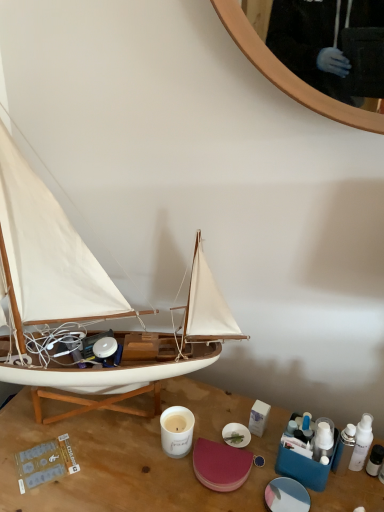
What are the coordinates of `wooden sailboat at left` in the screenshot? It's located at (87, 298).

In order to face wooden sailboat at left, should I rotate leftwards or rightwards?

Turn left approximately 12.879 degrees to face it.

The height and width of the screenshot is (512, 384). What do you see at coordinates (87, 298) in the screenshot? I see `wooden sailboat at left` at bounding box center [87, 298].

Where is `wooden desk at center`? This screenshot has height=512, width=384. wooden desk at center is located at coordinates (123, 465).

Describe the element at coordinates (123, 465) in the screenshot. I see `wooden desk at center` at that location.

At what (x,y) coordinates should I click in order to perform the action: click on wooden sailboat at left. Please return your answer as a coordinate pair (x, y). This screenshot has height=512, width=384. Looking at the image, I should click on (87, 298).

Visually, is wooden desk at center positioned to the left or to the right of wooden sailboat at left?

Clearly, wooden desk at center is on the right of wooden sailboat at left in the image.

Based on the photo, considering the positions of objects wooden desk at center and wooden sailboat at left in the image provided, who is in front, wooden desk at center or wooden sailboat at left?

wooden sailboat at left.

Between point (138, 490) and point (54, 345), which one is positioned behind?

Point (54, 345)

From the image's perspective, is wooden desk at center positioned above or below wooden sailboat at left?

wooden desk at center is situated lower than wooden sailboat at left in the image.

From a real-world perspective, is wooden desk at center on top of wooden sailboat at left?

No.

Is wooden desk at center thinner than wooden sailboat at left?

Incorrect, the width of wooden desk at center is not less than that of wooden sailboat at left.

Looking at this image, considering the sizes of objects wooden desk at center and wooden sailboat at left in the image provided, who is taller, wooden desk at center or wooden sailboat at left?

wooden sailboat at left is taller.

Which of these two, wooden desk at center or wooden sailboat at left, is bigger?

With larger size is wooden desk at center.

Does wooden desk at center contain wooden sailboat at left?

Definitely not — wooden sailboat at left is not inside wooden desk at center.

Is wooden desk at center not near wooden sailboat at left?

wooden desk at center is actually quite close to wooden sailboat at left.

Is wooden desk at center oriented towards wooden sailboat at left?

No, wooden desk at center is not aimed at wooden sailboat at left.

How different are the orientations of wooden desk at center and wooden sailboat at left in degrees?

wooden desk at center and wooden sailboat at left are facing 0.266 degrees away from each other.

At what (x,y) coordinates should I click in order to perform the action: click on boat above the wooden desk at center (from the image's perspective). Please return your answer as a coordinate pair (x, y). Image resolution: width=384 pixels, height=512 pixels. Looking at the image, I should click on (87, 298).

Considering the positions of objects wooden sailboat at left and wooden desk at center in the image provided, who is more to the left, wooden sailboat at left or wooden desk at center?

wooden sailboat at left.

Considering their positions, is wooden sailboat at left located in front of or behind wooden desk at center?

In the image, wooden sailboat at left appears in front of wooden desk at center.

Looking at this image, which is less distant, (x=0, y=207) or (x=227, y=418)?

Point (x=0, y=207)

From the image's perspective, is wooden sailboat at left over wooden desk at center?

Yes.

Based on the photo, from a real-world perspective, is wooden sailboat at left on wooden desk at center?

Correct, in the physical world, wooden sailboat at left is higher than wooden desk at center.

Consider the image. Considering the relative sizes of wooden sailboat at left and wooden desk at center in the image provided, is wooden sailboat at left thinner than wooden desk at center?

Yes.

Can you confirm if wooden sailboat at left is shorter than wooden desk at center?

No.

Considering the relative sizes of wooden sailboat at left and wooden desk at center in the image provided, is wooden sailboat at left smaller than wooden desk at center?

Yes.

Is wooden desk at center located within wooden sailboat at left?

No, wooden desk at center is located outside of wooden sailboat at left.

Are wooden sailboat at left and wooden desk at center far apart?

That's not correct — wooden sailboat at left is a little close to wooden desk at center.

Does wooden sailboat at left turn towards wooden desk at center?

No, wooden sailboat at left does not turn towards wooden desk at center.

Locate an element on the screen. This screenshot has height=512, width=384. boat located in front of the wooden desk at center is located at coordinates (87, 298).

You are a GUI agent. You are given a task and a screenshot of the screen. Output one action in this format:
    pyautogui.click(x=<x>, y=<y>)
    Task: Click on the desk below the wooden sailboat at left (from a real-world perspective)
    This screenshot has width=384, height=512.
    Given the screenshot: What is the action you would take?
    pyautogui.click(x=123, y=465)

In the image, there is a wooden desk at center. Where is `boat above it (from the image's perspective)`? The width and height of the screenshot is (384, 512). boat above it (from the image's perspective) is located at coordinates [x=87, y=298].